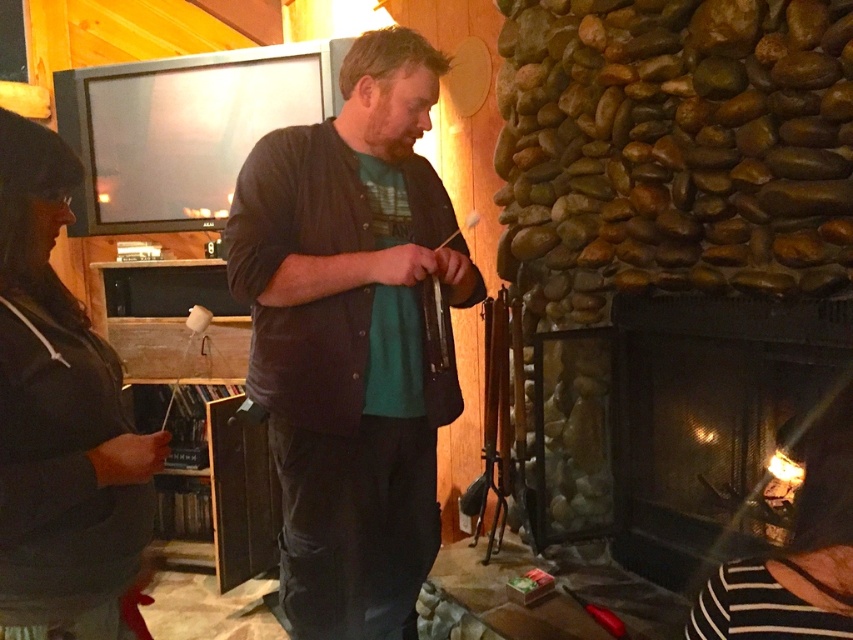
Looking at this image, can you confirm if black glass fireplace at lower right is shorter than dark gray sweater at left?

Incorrect, black glass fireplace at lower right's height does not fall short of dark gray sweater at left's.

Can you confirm if black glass fireplace at lower right is wider than dark gray sweater at left?

Indeed, black glass fireplace at lower right has a greater width compared to dark gray sweater at left.

Locate an element on the screen. black glass fireplace at lower right is located at coordinates (677, 424).

Is dark brown leather jacket at center wider than black glass fireplace at lower right?

No.

The height and width of the screenshot is (640, 853). What are the coordinates of `dark brown leather jacket at center` in the screenshot? It's located at (352, 339).

You are a GUI agent. You are given a task and a screenshot of the screen. Output one action in this format:
    pyautogui.click(x=<x>, y=<y>)
    Task: Click on the dark brown leather jacket at center
    The width and height of the screenshot is (853, 640).
    Given the screenshot: What is the action you would take?
    pyautogui.click(x=352, y=339)

Is dark brown leather jacket at center smaller than dark gray sweater at left?

No, dark brown leather jacket at center is not smaller than dark gray sweater at left.

Locate an element on the screen. This screenshot has width=853, height=640. dark brown leather jacket at center is located at coordinates (352, 339).